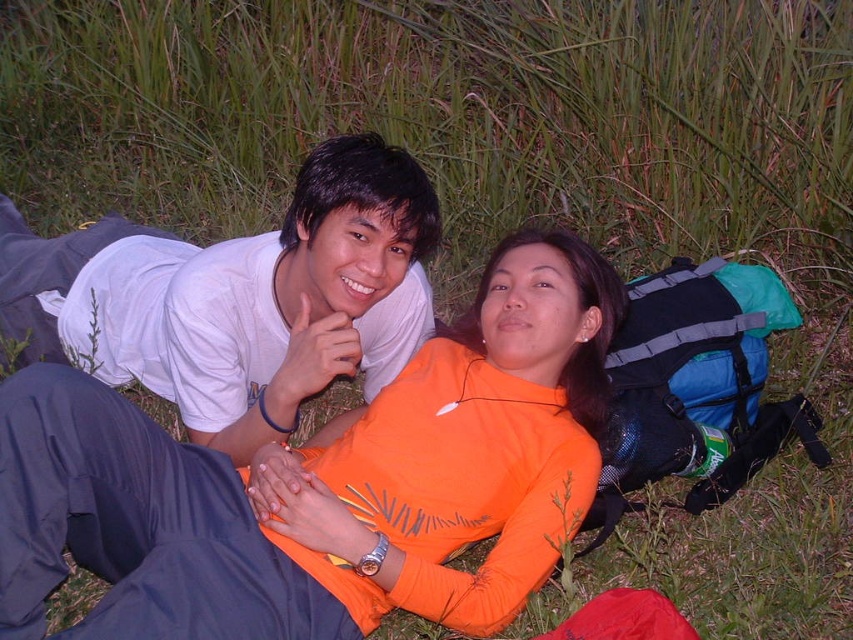
You are a GUI agent. You are given a task and a screenshot of the screen. Output one action in this format:
    pyautogui.click(x=<x>, y=<y>)
    Task: Click on the orange fleece at center
    The image size is (853, 640).
    Given the screenshot: What is the action you would take?
    pyautogui.click(x=325, y=483)

Which is in front, point (113, 556) or point (163, 298)?

Positioned in front is point (113, 556).

What do you see at coordinates (325, 483) in the screenshot?
I see `orange fleece at center` at bounding box center [325, 483].

At what (x,y) coordinates should I click in order to perform the action: click on orange fleece at center. Please return your answer as a coordinate pair (x, y). Looking at the image, I should click on (325, 483).